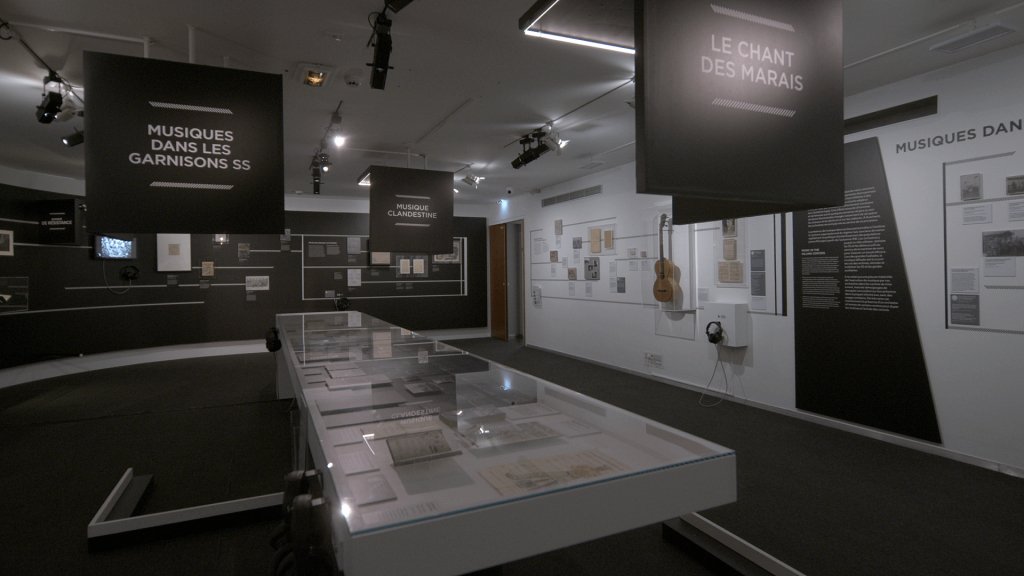
Image resolution: width=1024 pixels, height=576 pixels. I want to click on glass panes, so click(396, 410), click(361, 334).